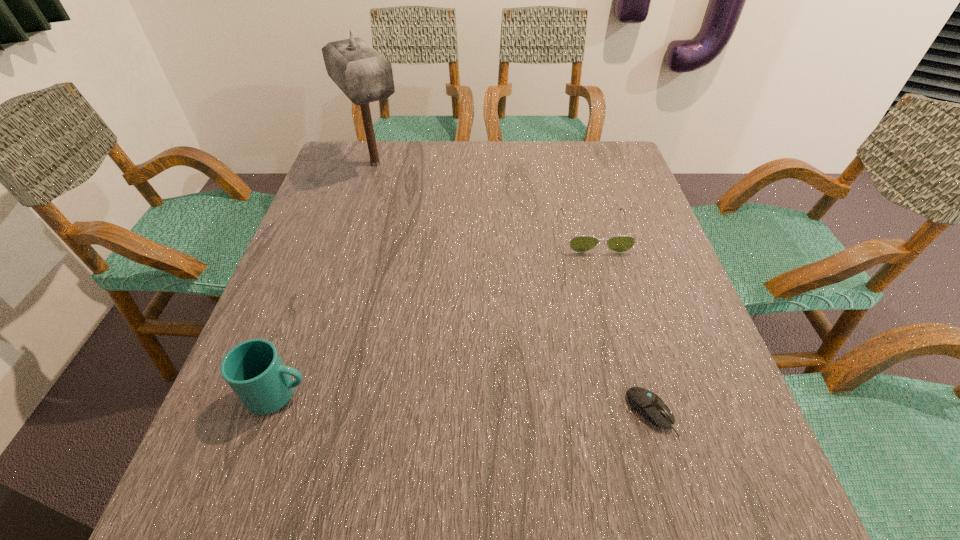
Where is `the tallest object`? The image size is (960, 540). the tallest object is located at coordinates (363, 75).

Locate an element on the screen. The width and height of the screenshot is (960, 540). the farthest object is located at coordinates (363, 75).

Locate an element on the screen. This screenshot has height=540, width=960. cup is located at coordinates (254, 370).

Where is `the second farthest object`? Image resolution: width=960 pixels, height=540 pixels. the second farthest object is located at coordinates (580, 244).

Identify the location of sunglasses. (580, 244).

Image resolution: width=960 pixels, height=540 pixels. Find the location of `the shortest object`. the shortest object is located at coordinates (648, 404).

Identify the location of free space located 0.110m on the front of the tallest object. (362, 209).

You are a GUI agent. You are given a task and a screenshot of the screen. Output one action in this format:
    pyautogui.click(x=<x>, y=<y>)
    Task: Click on the vacant region located 0.070m on the handle side of the cup
    This screenshot has height=540, width=960.
    Given the screenshot: What is the action you would take?
    pyautogui.click(x=350, y=394)

Locate an element on the screen. The width and height of the screenshot is (960, 540). free region located 0.140m on the front-facing side of the second shortest object is located at coordinates (612, 298).

At what (x,y) coordinates should I click in order to perform the action: click on blank area located 0.140m on the left of the shortest object. Please return your answer as a coordinate pair (x, y). The image size is (960, 540). Looking at the image, I should click on (548, 413).